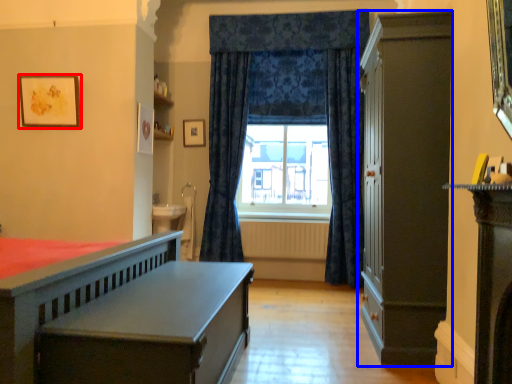
Question: Which of the following is the farthest to the observer, picture frame (highlighted by a red box) or cabinetry (highlighted by a blue box)?

Choices:
 (A) picture frame
 (B) cabinetry

Answer: (A)